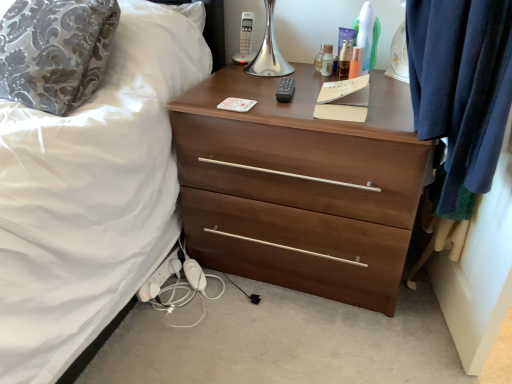
Locate an element on the screen. The image size is (512, 384). free space in front of translucent plastic bottles at upper right, which is the 2th toiletry in right-to-left order is located at coordinates (369, 102).